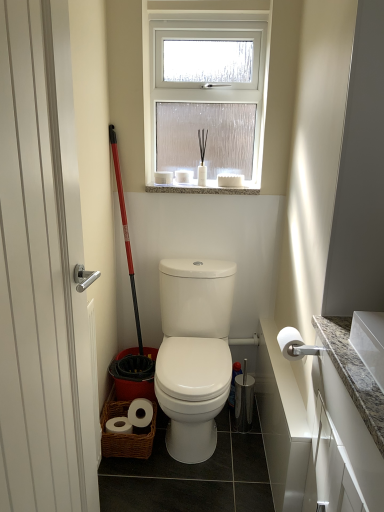
The width and height of the screenshot is (384, 512). In order to click on free point in front of white glossy toilet at center in this screenshot , I will do `click(192, 471)`.